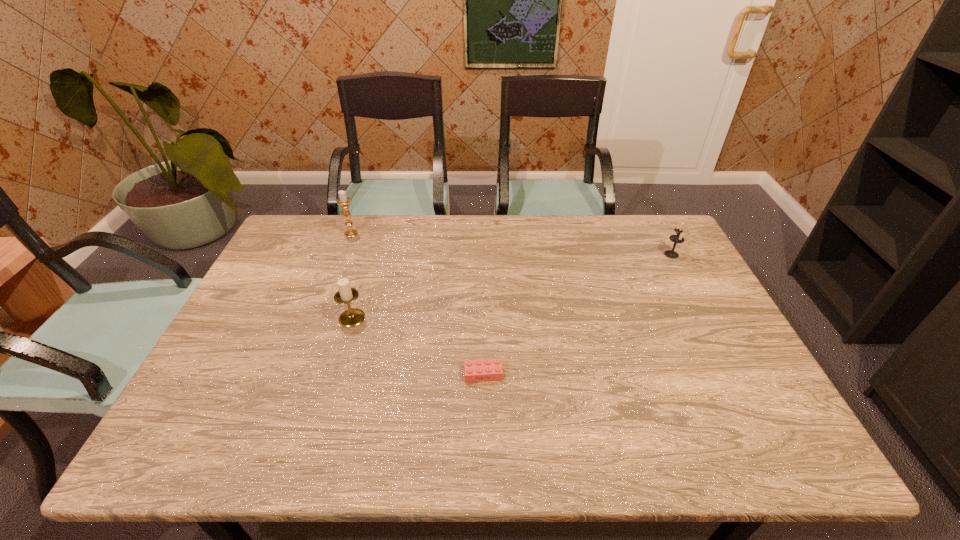
Locate an element on the screen. The image size is (960, 540). vacant space in between the rightmost candle holder and the second object from left to right is located at coordinates (512, 286).

Image resolution: width=960 pixels, height=540 pixels. In order to click on unoccupied area between the second nearest candle holder and the nearest object in this screenshot , I will do pyautogui.click(x=577, y=314).

I want to click on free point between the rightmost candle holder and the nearest candle holder, so click(512, 286).

This screenshot has width=960, height=540. In order to click on vacant area that lies between the third nearest object and the tallest object in this screenshot , I will do `click(512, 244)`.

Locate an element on the screen. The image size is (960, 540). free point between the second candle holder from left to right and the third nearest object is located at coordinates (512, 286).

What are the coordinates of `vacant space that is in between the rightmost object and the nearest object` in the screenshot? It's located at (577, 314).

This screenshot has width=960, height=540. Find the location of `free space that is in between the second farthest candle holder and the second candle holder from right to left`. free space that is in between the second farthest candle holder and the second candle holder from right to left is located at coordinates (512, 286).

Locate an element on the screen. free space between the Lego and the nearest candle holder is located at coordinates (418, 346).

Identify the location of vacant point located between the second farthest candle holder and the second nearest object. The height and width of the screenshot is (540, 960). (512, 286).

Locate an element on the screen. empty space that is in between the second nearest candle holder and the nearest object is located at coordinates (577, 314).